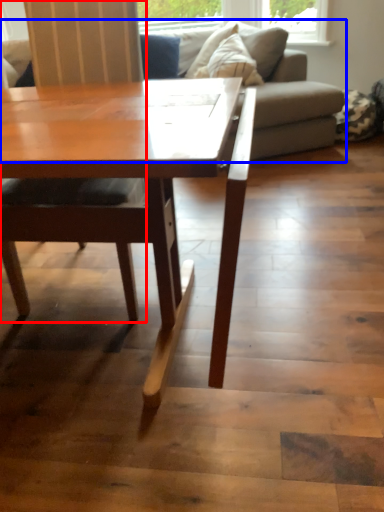
Question: Which object is closer to the camera taking this photo, chair (highlighted by a red box) or studio couch (highlighted by a blue box)?

Choices:
 (A) chair
 (B) studio couch

Answer: (A)